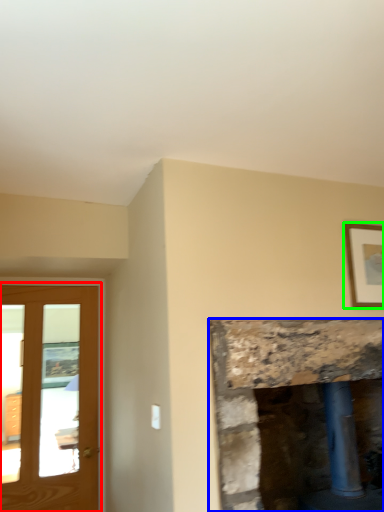
Question: Considering the real-world distances, which object is farthest from screen door (highlighted by a red box)? fireplace (highlighted by a blue box) or picture frame (highlighted by a green box)?

Choices:
 (A) fireplace
 (B) picture frame

Answer: (B)